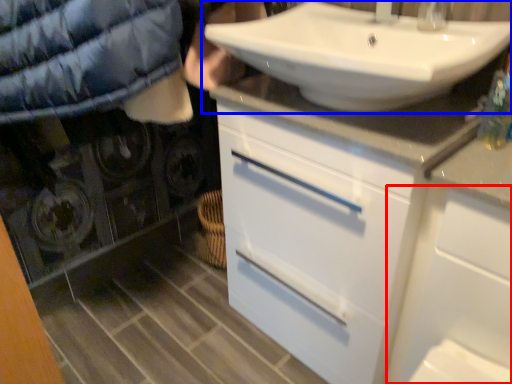
Question: Which object appears farthest to the camera in this image, cabinetry (highlighted by a red box) or sink (highlighted by a blue box)?

Choices:
 (A) cabinetry
 (B) sink

Answer: (B)